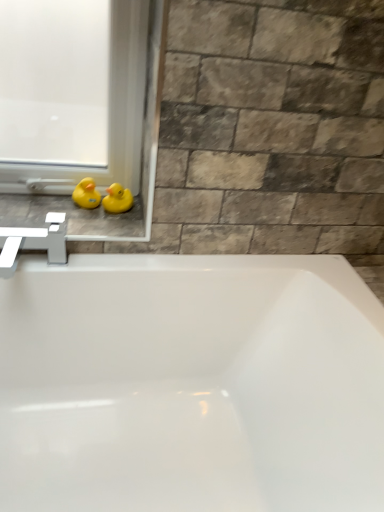
You are a GUI agent. You are given a task and a screenshot of the screen. Output one action in this format:
    pyautogui.click(x=<x>, y=<y>)
    Task: Click on the free space to the left of yellow rubber duck at left, which is the 2th duck in right-to-left order
    The image size is (384, 512).
    Given the screenshot: What is the action you would take?
    pyautogui.click(x=37, y=205)